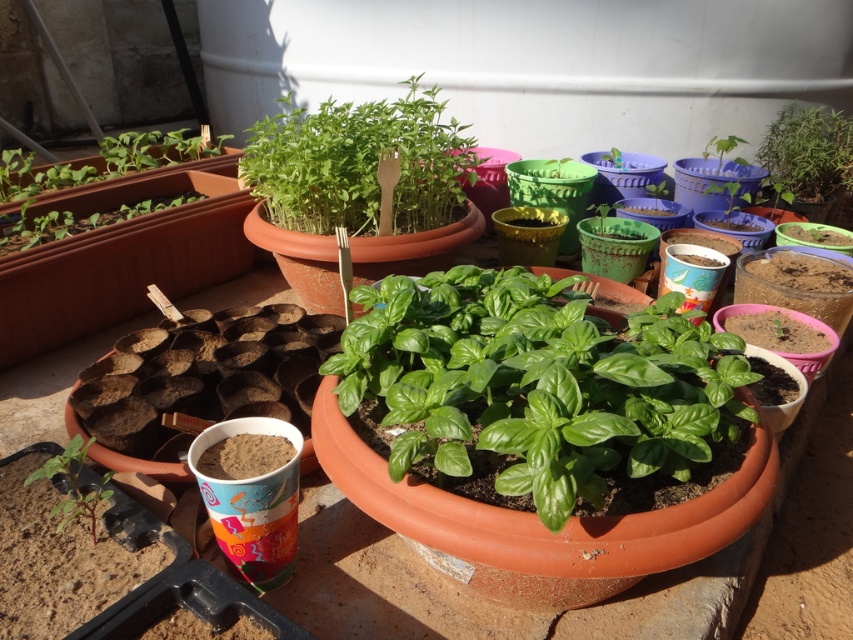
From the picture: Who is higher up, green matte plant at upper right or green matte seedling at lower left?

green matte plant at upper right is higher up.

Who is more distant from viewer, [822,120] or [90,522]?

Point [822,120]

The height and width of the screenshot is (640, 853). Describe the element at coordinates (807, 152) in the screenshot. I see `green matte plant at upper right` at that location.

Identify the location of green matte plant at upper right. (807, 152).

Who is higher up, green glossy basil at center or green matte plant at upper right?

green matte plant at upper right is higher up.

The image size is (853, 640). I want to click on green glossy basil at center, so click(x=538, y=394).

Which of these two, green glossy basil at center or green matte plant at upper center, stands taller?

Standing taller between the two is green matte plant at upper center.

Image resolution: width=853 pixels, height=640 pixels. What do you see at coordinates (538, 394) in the screenshot? I see `green glossy basil at center` at bounding box center [538, 394].

Find the location of a particular element. The height and width of the screenshot is (640, 853). green glossy basil at center is located at coordinates (538, 394).

In order to click on green glossy basil at center in this screenshot , I will do `click(538, 394)`.